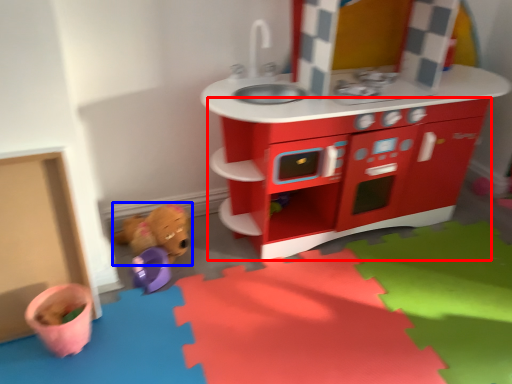
Question: Which object appears closest to the camera in this image, cabinetry (highlighted by a red box) or toy (highlighted by a blue box)?

Choices:
 (A) cabinetry
 (B) toy

Answer: (A)